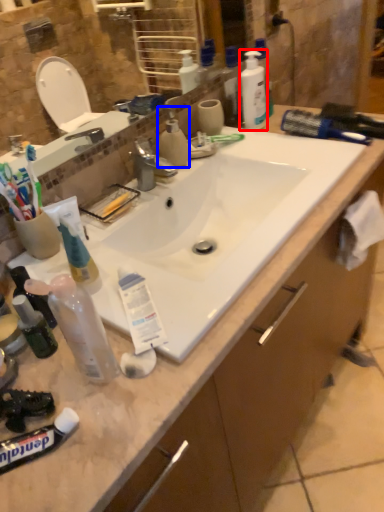
Question: Which of the following is the closest to the observer, cleaning product (highlighted by a red box) or cleaning product (highlighted by a blue box)?

Choices:
 (A) cleaning product
 (B) cleaning product

Answer: (B)